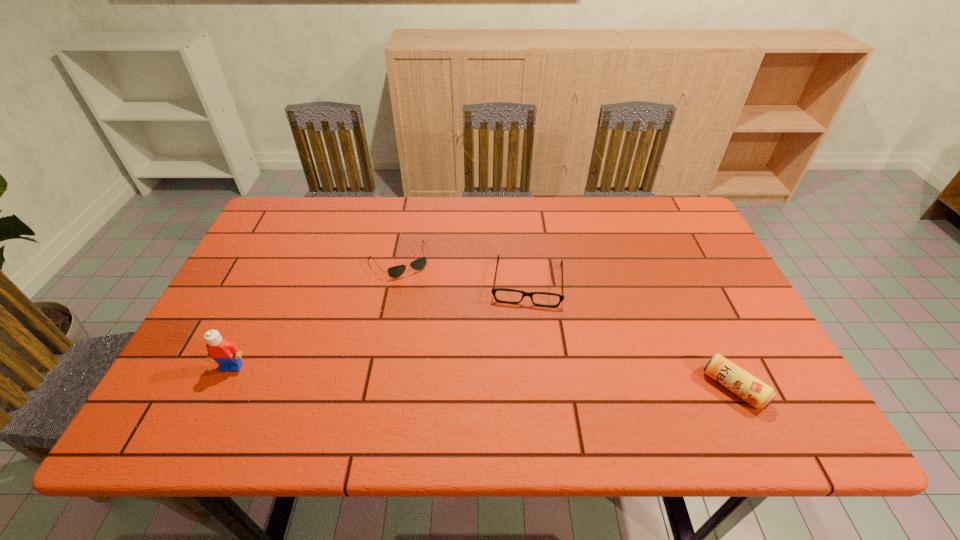
At what (x,y) coordinates should I click in order to perform the action: click on free space located on the front-facing side of the spectacles. Please return your answer as a coordinate pair (x, y). The height and width of the screenshot is (540, 960). Looking at the image, I should click on (524, 323).

Locate an element on the screen. This screenshot has height=540, width=960. vacant area located 0.150m on the front-facing side of the spectacles is located at coordinates (522, 356).

This screenshot has height=540, width=960. What are the coordinates of `object that is at the far edge` in the screenshot? It's located at [x=396, y=271].

Locate an element on the screen. Image resolution: width=960 pixels, height=540 pixels. Lego situated at the near edge is located at coordinates (226, 354).

Find the location of `beer can that is at the near edge`. beer can that is at the near edge is located at coordinates (746, 386).

The height and width of the screenshot is (540, 960). What are the coordinates of `object that is at the left edge` in the screenshot? It's located at (226, 354).

Where is `object that is at the right edge`? This screenshot has height=540, width=960. object that is at the right edge is located at coordinates (746, 386).

What are the coordinates of `object that is at the near left corner` in the screenshot? It's located at (226, 354).

Where is `object present at the near right corner`? object present at the near right corner is located at coordinates (746, 386).

I want to click on vacant space at the far edge, so click(376, 202).